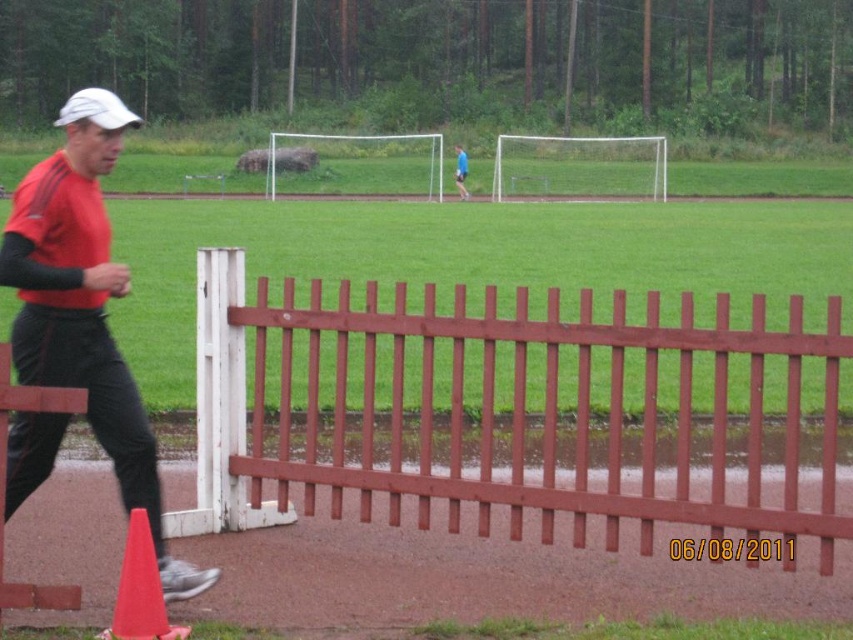
You are a photographer trying to capture the brown wooden fence at center and the orange matte traffic cone at lower left in your shot. Based on their positions, which object should you focus on first to ensure both are in frame?

The brown wooden fence at center is above the orange matte traffic cone at lower left, so you should focus on the orange matte traffic cone at lower left first to ensure both are in frame.

You are a photographer standing at the edge of the soccer field. You need to take a photo that includes both the brown wooden fence at center and the matte red shirt at left. Based on their positions, which object should appear higher in the photo?

The matte red shirt at left appears higher in the photo because the brown wooden fence at center is positioned below it.

Based on the photo, you are a photographer setting up a shot of the sports field. You notice the matte red shirt at left and the blue fabric shirt at center. Which shirt is closer to the camera?

The matte red shirt at left is positioned under the blue fabric shirt at center, so the blue fabric shirt at center is closer to the camera.